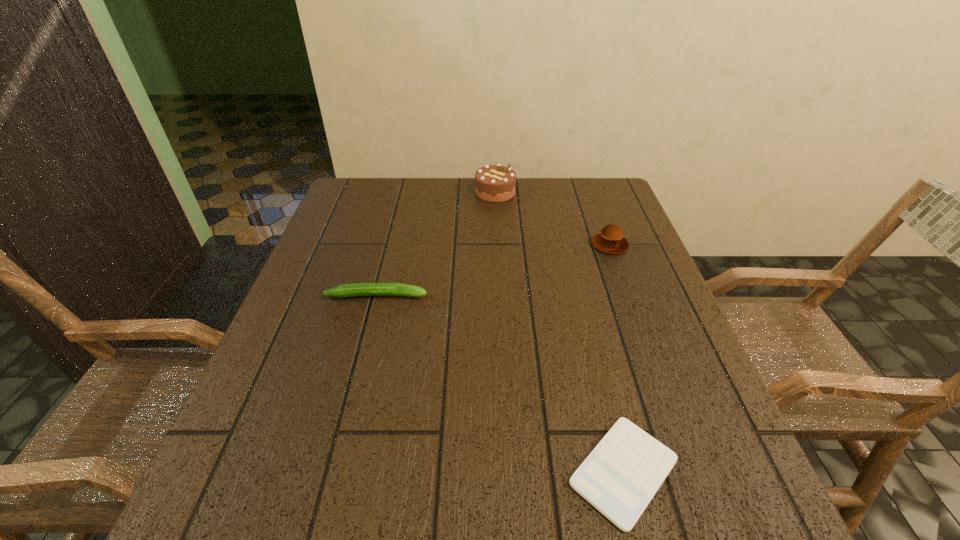
Where is `vacant region between the third farthest object and the nearest object`? The width and height of the screenshot is (960, 540). vacant region between the third farthest object and the nearest object is located at coordinates (500, 383).

What are the coordinates of `vacant point located between the farthest object and the zucchini` in the screenshot? It's located at (436, 244).

Locate an element on the screen. The height and width of the screenshot is (540, 960). object that is the nearest to the third farthest object is located at coordinates (621, 475).

Select which object is the closest to the chocolate cake. Please provide its 2D coordinates. Your answer should be formatted as a tuple, i.e. [(x, y)], where the tuple contains the x and y coordinates of a point satisfying the conditions above.

[(611, 240)]

You are a GUI agent. You are given a task and a screenshot of the screen. Output one action in this format:
    pyautogui.click(x=<x>, y=<y>)
    Task: Click on the vacant space that satisfies the following two spatial constraints: 1. on the front-facing side of the leftmost object; 2. on the back side of the shortest object
    The width and height of the screenshot is (960, 540).
    Given the screenshot: What is the action you would take?
    pyautogui.click(x=332, y=471)

Identify the location of free space that satisfies the following two spatial constraints: 1. on the front-facing side of the nearest object; 2. on the right side of the leftmost object. (332, 471).

Image resolution: width=960 pixels, height=540 pixels. In order to click on free space that satisfies the following two spatial constraints: 1. on the back side of the nearest object; 2. on the right side of the third shortest object in this screenshot , I will do `click(567, 245)`.

Where is `vacant space that satisfies the following two spatial constraints: 1. on the front side of the second tallest object; 2. on the right side of the farthest object`? vacant space that satisfies the following two spatial constraints: 1. on the front side of the second tallest object; 2. on the right side of the farthest object is located at coordinates click(x=497, y=245).